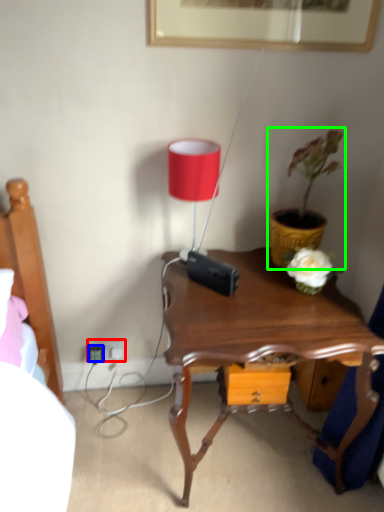
Question: Considering the real-world distances, which object is farthest from electric outlet (highlighted by a red box)? plug (highlighted by a blue box) or houseplant (highlighted by a green box)?

Choices:
 (A) plug
 (B) houseplant

Answer: (B)